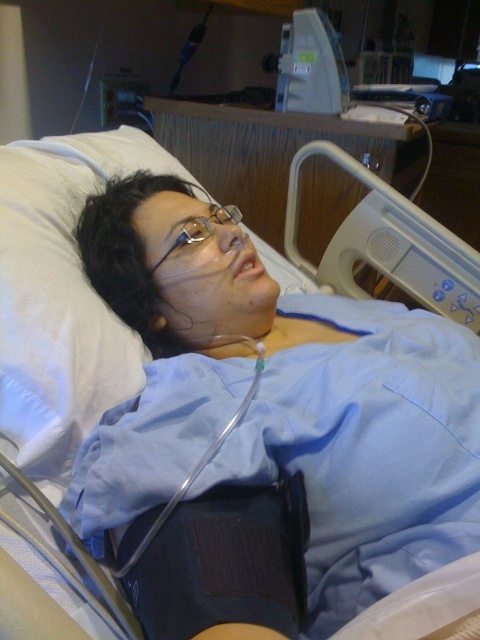
Question: Which of the following is the closest to the observer?

Choices:
 (A) gray plastic monitor at upper center
 (B) clear plastic glasses at center

Answer: (B)

Question: Is white soft pillow at upper left above gray plastic monitor at upper center?

Choices:
 (A) no
 (B) yes

Answer: (A)

Question: Considering the real-world distances, which object is closest to the gray plastic monitor at upper center?

Choices:
 (A) white soft pillow at upper left
 (B) clear plastic glasses at center

Answer: (A)

Question: Is white soft pillow at upper left below clear plastic glasses at center?

Choices:
 (A) yes
 (B) no

Answer: (B)

Question: Can you confirm if white plastic hospital bed rail at upper right is positioned below clear plastic glasses at center?

Choices:
 (A) no
 (B) yes

Answer: (A)

Question: Which point is farther to the camera?

Choices:
 (A) white soft pillow at upper left
 (B) clear plastic glasses at center

Answer: (B)